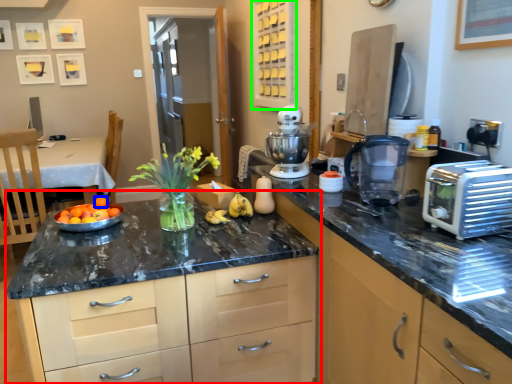
Question: Based on their relative distances, which object is farther from cabinetry (highlighted by a red box)? Choose from orange (highlighted by a blue box) and cabinetry (highlighted by a green box).

Choices:
 (A) orange
 (B) cabinetry

Answer: (B)